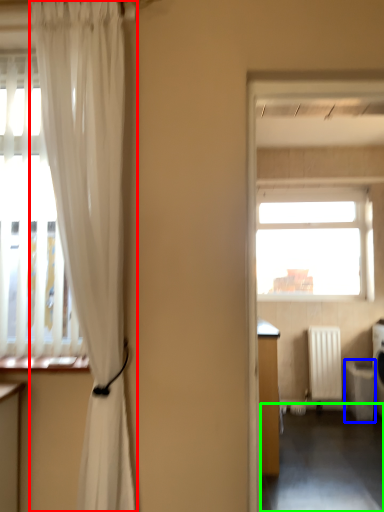
Question: Which is farther away from curtain (highlighted by a red box)? dish washer (highlighted by a blue box) or corridor (highlighted by a green box)?

Choices:
 (A) dish washer
 (B) corridor

Answer: (A)